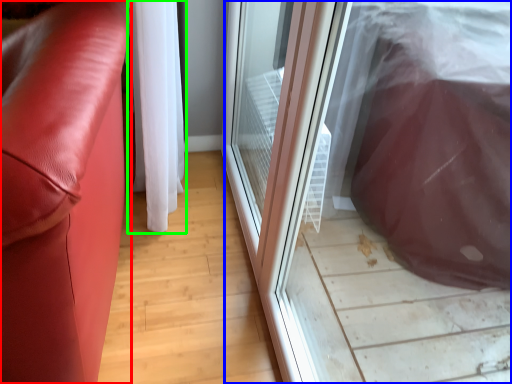
Question: Which object is the farthest from furniture (highlighted by a red box)? Choose among these: screen door (highlighted by a blue box) or curtain (highlighted by a green box).

Choices:
 (A) screen door
 (B) curtain

Answer: (A)